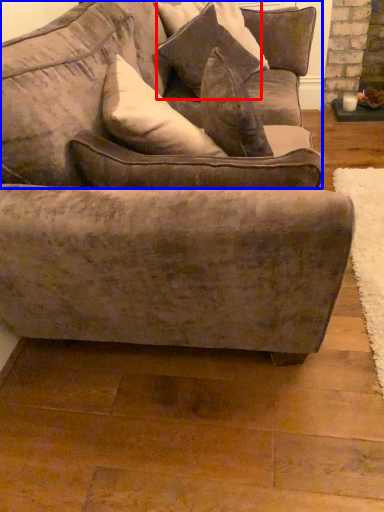
Question: Which point is further to the camera, pillow (highlighted by a red box) or couch (highlighted by a blue box)?

Choices:
 (A) pillow
 (B) couch

Answer: (A)